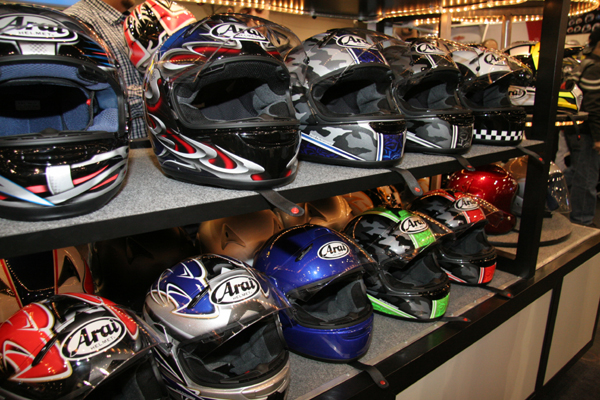
Where is `lights`? lights is located at coordinates (471, 8).